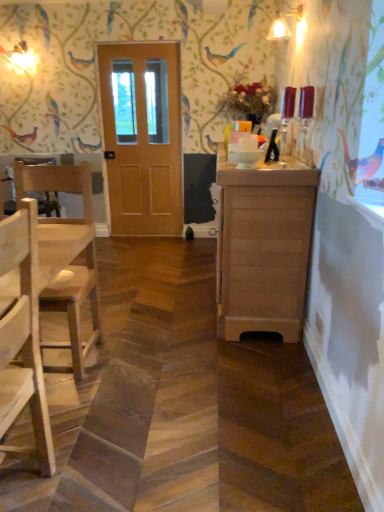
Image resolution: width=384 pixels, height=512 pixels. What are the coordinates of `empty space that is ontop of wooden door at center` in the screenshot? It's located at (131, 45).